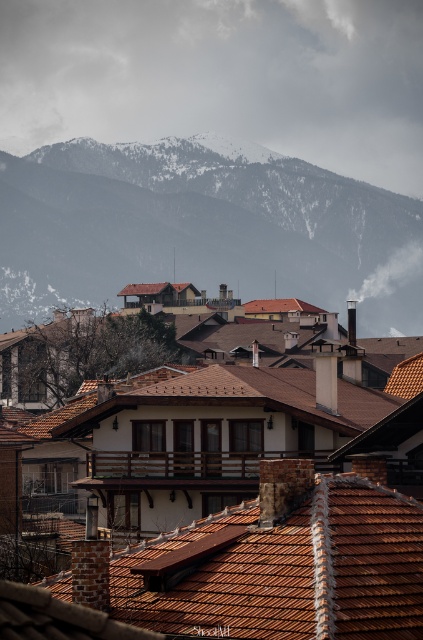
Between white fluffy cloud at upper center and snowy rock mountain at upper center, which one appears on the right side from the viewer's perspective?

snowy rock mountain at upper center

Does point (252, 33) come closer to viewer compared to point (10, 212)?

No, it is behind (10, 212).

The image size is (423, 640). I want to click on white fluffy cloud at upper center, so click(222, 76).

Can you confirm if brown tiled roof at center is positioned to the right of snowy rock mountain at upper center?

Correct, you'll find brown tiled roof at center to the right of snowy rock mountain at upper center.

Who is more distant from viewer, (280, 598) or (321, 300)?

Positioned behind is point (321, 300).

In the scene shown: Measure the distance between point [241,522] and camera.

Point [241,522] is 39.67 meters away from camera.

Image resolution: width=423 pixels, height=640 pixels. In order to click on brown tiled roof at center in this screenshot , I will do `click(244, 499)`.

The width and height of the screenshot is (423, 640). What do you see at coordinates (203, 228) in the screenshot?
I see `snowy rock mountain at upper center` at bounding box center [203, 228].

Between point (365, 196) and point (253, 506), which one is positioned behind?

Positioned behind is point (365, 196).

The height and width of the screenshot is (640, 423). Identify the location of snowy rock mountain at upper center. (203, 228).